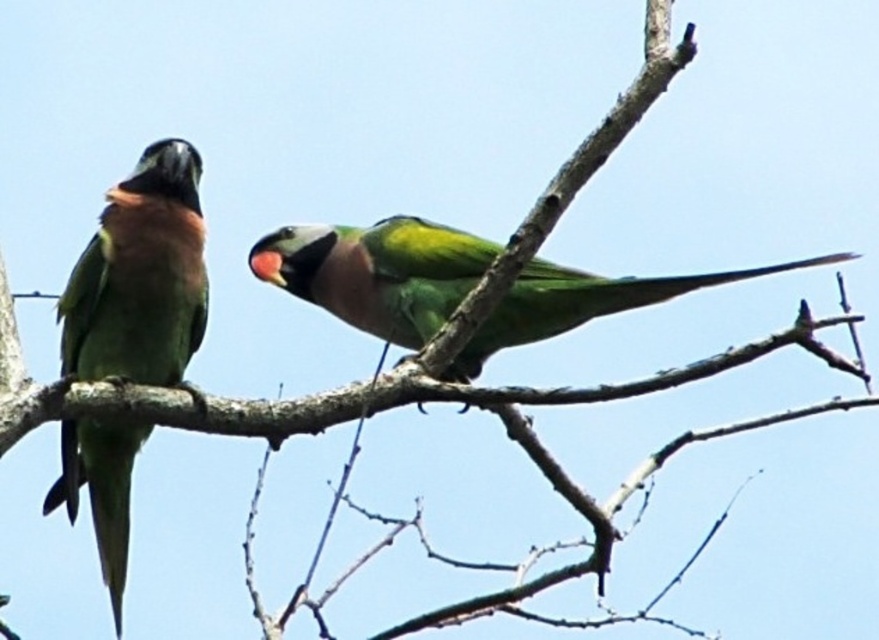
You are a birdwatcher observing two parrots on a branch. You see the green matte parrot at left and the green matte parrot at center. Which parrot is positioned further to the left?

The green matte parrot at left is positioned further to the left than the green matte parrot at center.

You are an ornithologist observing two parrots on a branch. You notice the green matte parrot at left and the green matte parrot at center. Which parrot appears smaller in width when viewed from your position?

The green matte parrot at left has a lesser width compared to the green matte parrot at center, so it appears smaller in width.

Based on the photo, you are a photographer aiming to capture a closeup shot of the green matte parrot at left. Given that your camera can focus on subjects within 2 meters, will you be able to get a clear closeup without moving closer?

The green matte parrot at left is 2.96 meters away from the camera, which is beyond the 2 meter focus range. Therefore, you cannot get a clear closeup without moving closer.